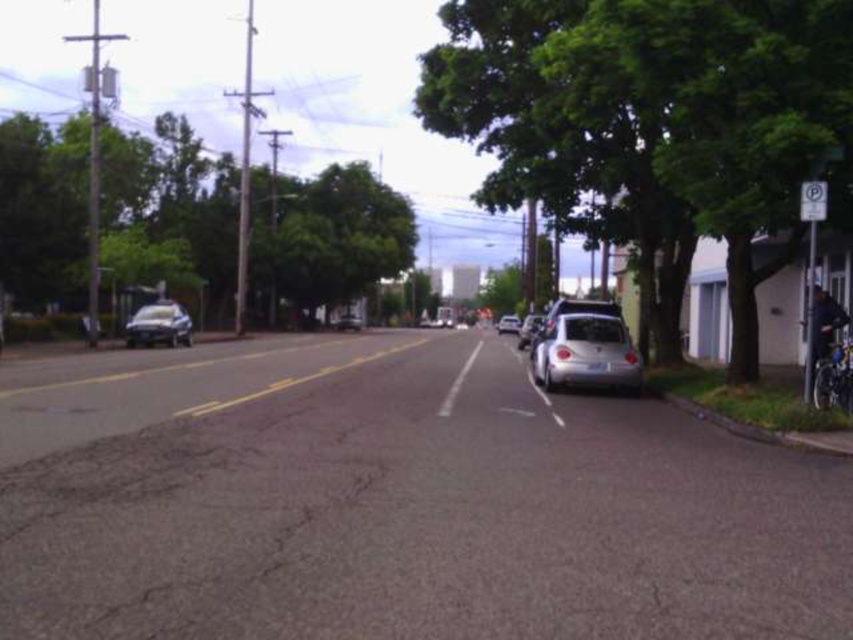
You are a delivery person standing at the point marked by the coordinates point (654, 125). You need to deliver a package to the address located at the green leafy tree at right. Are you already at the correct location?

Yes, you are already at the correct location because the point (654, 125) is on the green leafy tree at right.

You are a delivery person trying to park your van between the satin silver car at right and the silver metallic hatchback at right. The van is 6 meters long. Is there enough space between them to park your van?

The distance between the satin silver car at right and the silver metallic hatchback at right is 21.05 meters. Since the van is only 6 meters long, there is sufficient space to park between them.